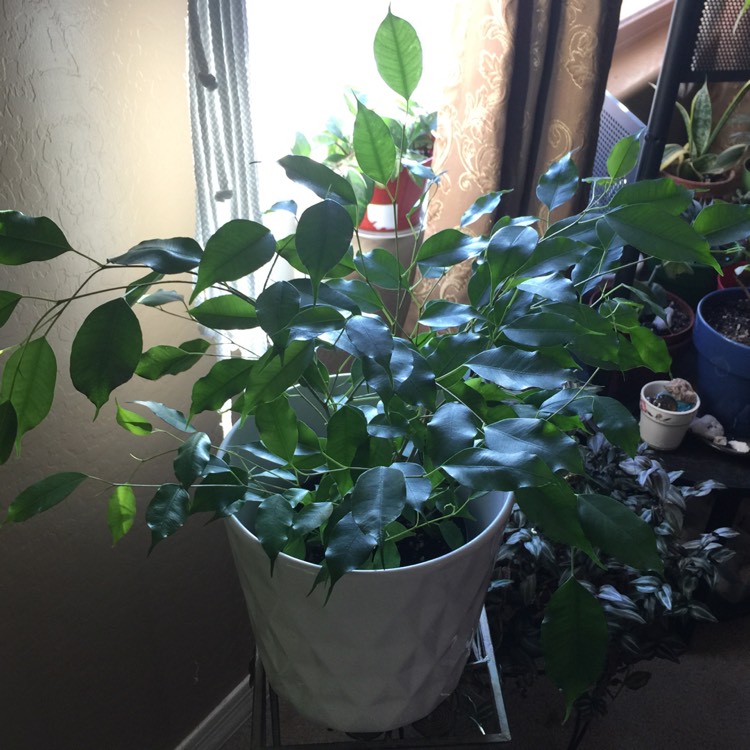
Image resolution: width=750 pixels, height=750 pixels. Identify the location of pots. (670, 430), (724, 349), (697, 183), (678, 339), (714, 274), (370, 624), (400, 195).